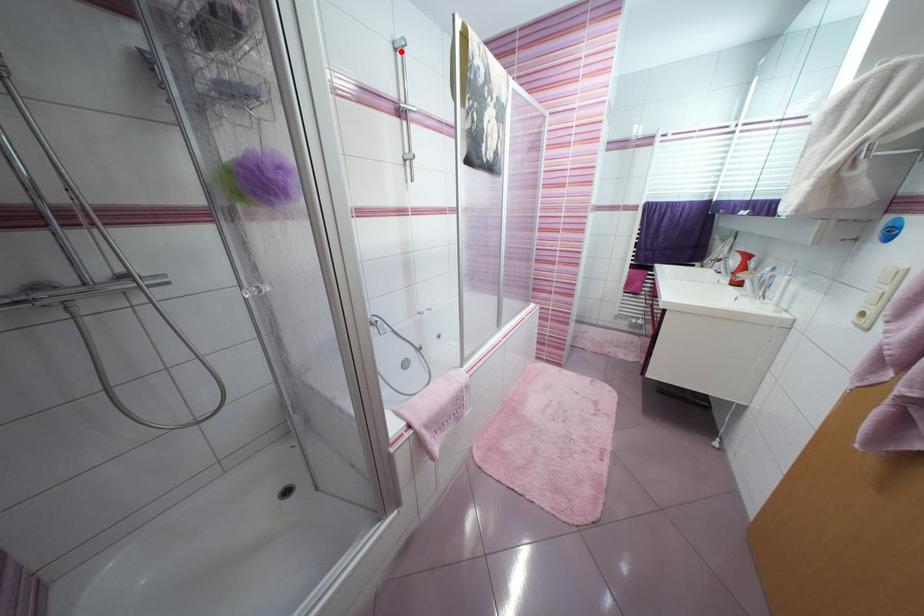
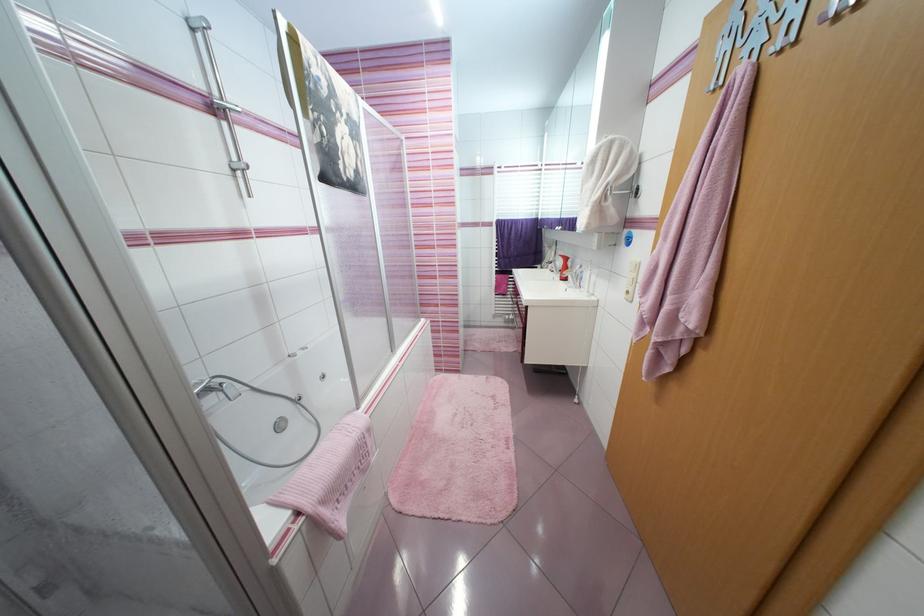
In the second image, find the point that corresponds to the highlighted location in the first image.

(198, 31)